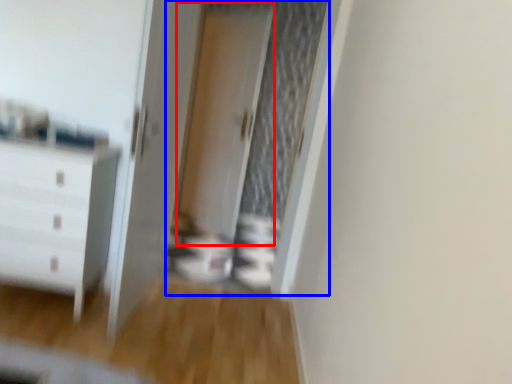
Question: Which object appears closest to the camera in this image, screen door (highlighted by a red box) or screen door (highlighted by a blue box)?

Choices:
 (A) screen door
 (B) screen door

Answer: (B)